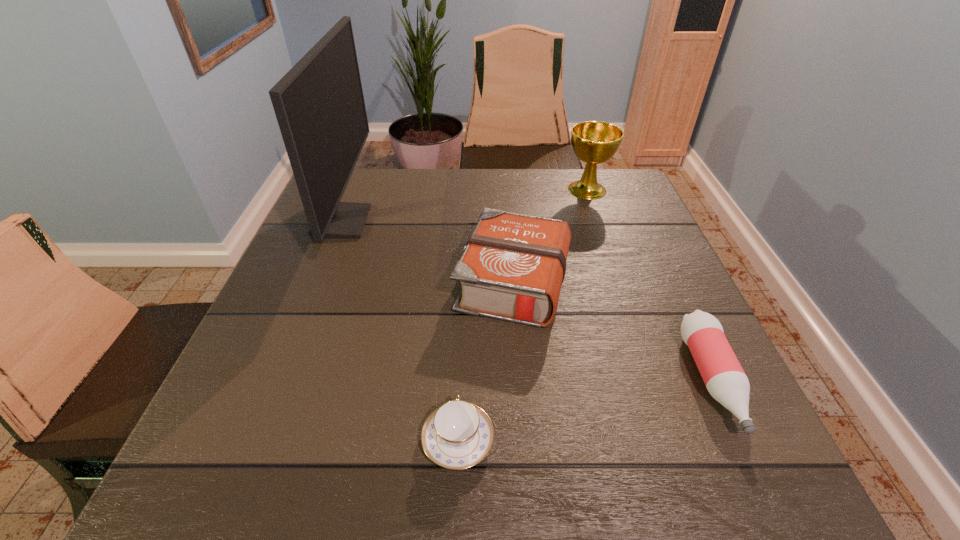
This screenshot has width=960, height=540. Find the location of `bottle located at the right edge`. bottle located at the right edge is located at coordinates (725, 380).

You are a GUI agent. You are given a task and a screenshot of the screen. Output one action in this format:
    pyautogui.click(x=<x>, y=<y>)
    Task: Click on the object that is at the far left corner
    The image size is (960, 540).
    Given the screenshot: What is the action you would take?
    pyautogui.click(x=319, y=104)

You are a GUI agent. You are given a task and a screenshot of the screen. Output one action in this format:
    pyautogui.click(x=<x>, y=<y>)
    Task: Click on the object at the far right corner
    The width and height of the screenshot is (960, 540).
    Given the screenshot: What is the action you would take?
    pyautogui.click(x=594, y=142)

The width and height of the screenshot is (960, 540). Identify the location of object that is at the near right corner. (725, 380).

Locate an element on the screen. blank space at the far edge is located at coordinates (408, 206).

At what (x,y) coordinates should I click in order to perform the action: click on blank area at the near edge. Please return your answer as a coordinate pair (x, y). Looking at the image, I should click on (580, 489).

The width and height of the screenshot is (960, 540). Find the location of `vacant space at the left edge`. vacant space at the left edge is located at coordinates (246, 416).

Find the location of `vacant space at the right edge of the desktop`. vacant space at the right edge of the desktop is located at coordinates (651, 261).

Find the location of `vacant space at the far left corner of the desktop`. vacant space at the far left corner of the desktop is located at coordinates (374, 170).

Identify the location of vacant space at the near left corner of the desktop. (279, 495).